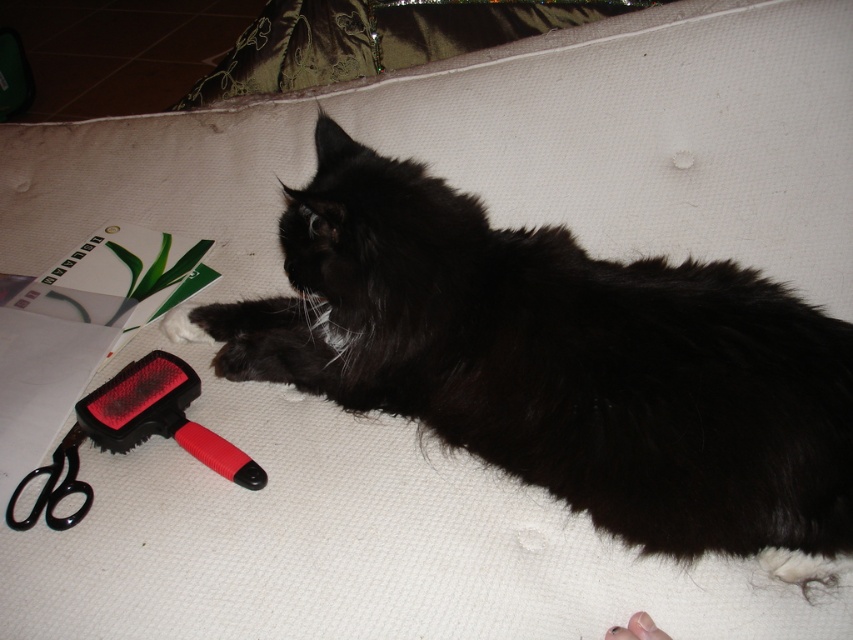
Between point (250, 371) and point (149, 372), which one is positioned behind?

Point (250, 371)

Which of these two, black fluffy cat at center or red plastic brush at lower left, stands shorter?

With less height is red plastic brush at lower left.

Is point (421, 189) farther from viewer compared to point (54, 451)?

No, it is not.

This screenshot has width=853, height=640. Identify the location of black fluffy cat at center. (560, 362).